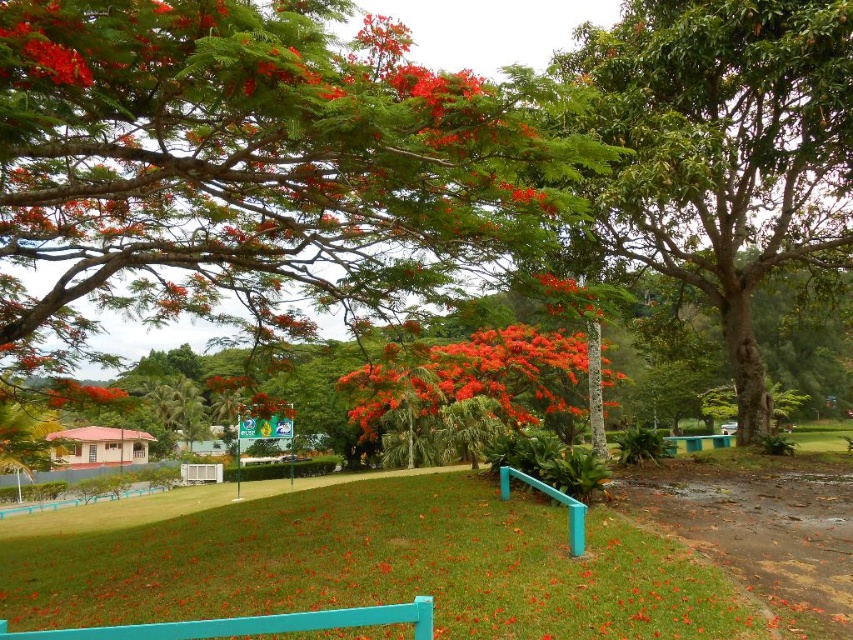
Does point (628, 67) come farther from viewer compared to point (550, 276)?

Yes, point (628, 67) is behind point (550, 276).

Does green glossy tree at center appear under bright orange flower at center?

No.

What do you see at coordinates (724, 148) in the screenshot? The image size is (853, 640). I see `green glossy tree at center` at bounding box center [724, 148].

You are a GUI agent. You are given a task and a screenshot of the screen. Output one action in this format:
    pyautogui.click(x=<x>, y=<y>)
    Task: Click on the green glossy tree at center
    
    Given the screenshot: What is the action you would take?
    pyautogui.click(x=724, y=148)

Can you confirm if bright red flowers at center is smaller than bright orange flower at center?

Incorrect, bright red flowers at center is not smaller in size than bright orange flower at center.

Between bright red flowers at center and bright orange flower at center, which one has less height?

Standing shorter between the two is bright orange flower at center.

Between point (544, 396) and point (561, 284), which one is positioned in front?

Point (561, 284) is more forward.

Image resolution: width=853 pixels, height=640 pixels. I want to click on bright red flowers at center, so click(477, 376).

Who is positioned more to the right, bright red flowers at center or bright red petals at center?

bright red flowers at center

Who is more forward, (529,378) or (114,392)?

Point (114,392)

Locate an element on the screen. bright red flowers at center is located at coordinates (477, 376).